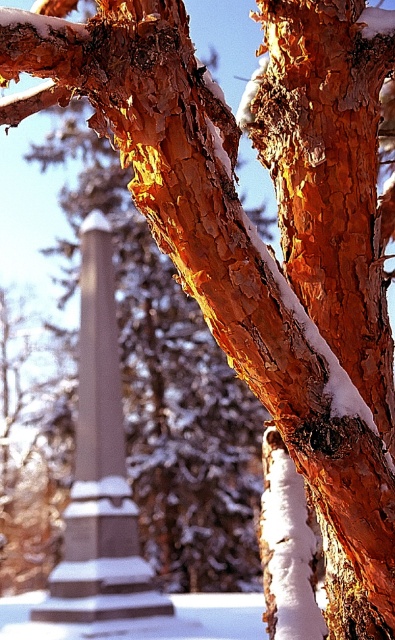
Question: Which of the following is the farthest from the observer?

Choices:
 (A) (261, 113)
 (B) (109, 596)

Answer: (B)

Question: Among these objects, which one is farthest from the camera?

Choices:
 (A) smooth gray stone column at center
 (B) orange bark tree trunk at center

Answer: (A)

Question: Can you confirm if orange bark tree trunk at center is positioned below smooth gray stone column at center?

Choices:
 (A) no
 (B) yes

Answer: (A)

Question: Can you confirm if orange bark tree trunk at center is smaller than smooth gray stone column at center?

Choices:
 (A) no
 (B) yes

Answer: (B)

Question: Is orange bark tree trunk at center below smooth gray stone column at center?

Choices:
 (A) yes
 (B) no

Answer: (B)